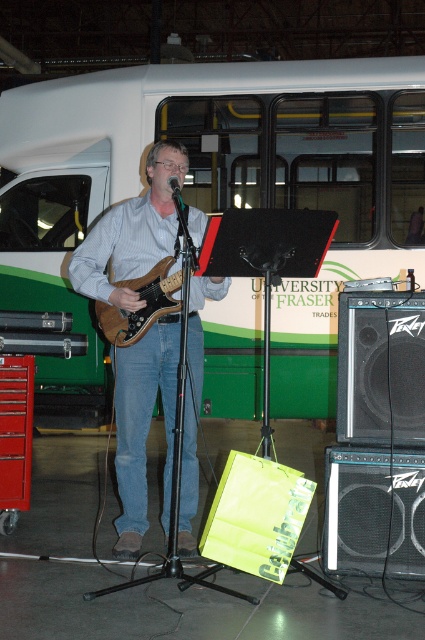
Does brown wood guitar at center have a lesser height compared to black matte microphone at center?

Incorrect, brown wood guitar at center's height does not fall short of black matte microphone at center's.

Who is positioned more to the right, brown wood guitar at center or black matte microphone at center?

Positioned to the right is black matte microphone at center.

What do you see at coordinates (142, 307) in the screenshot? I see `brown wood guitar at center` at bounding box center [142, 307].

Where is `brown wood guitar at center`? The image size is (425, 640). brown wood guitar at center is located at coordinates (142, 307).

Does matte brown guitar at center appear over brown wood guitar at center?

Actually, matte brown guitar at center is below brown wood guitar at center.

Does matte brown guitar at center appear under brown wood guitar at center?

Yes, matte brown guitar at center is below brown wood guitar at center.

Between point (136, 545) and point (150, 292), which one is positioned in front?

Point (150, 292) is in front.

I want to click on matte brown guitar at center, so click(x=142, y=428).

Who is positioned more to the right, matte brown guitar at center or black matte microphone at center?

black matte microphone at center

Is matte brown guitar at center positioned before black matte microphone at center?

No.

Which is in front, point (204, 300) or point (172, 184)?

Point (172, 184) is in front.

Identify the location of matte brown guitar at center. (142, 428).